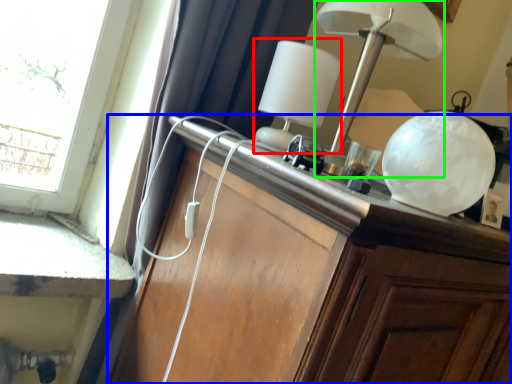
Question: Based on their relative distances, which object is farther from table lamp (highlighted by a red box)? Choose from cabinetry (highlighted by a blue box) and lamp (highlighted by a green box).

Choices:
 (A) cabinetry
 (B) lamp

Answer: (A)